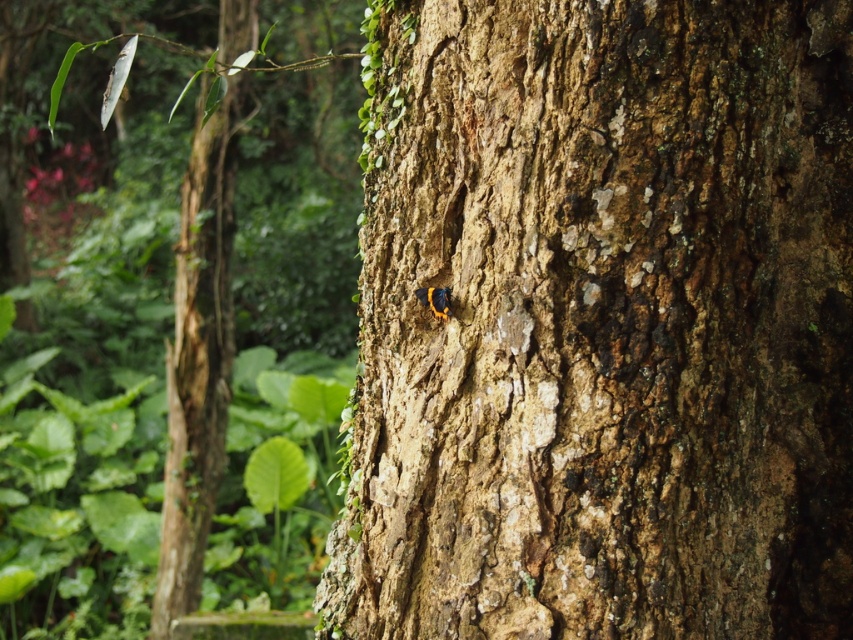
Question: Can you confirm if smooth bark tree trunk at center is wider than shiny orange butterfly at center?

Choices:
 (A) no
 (B) yes

Answer: (B)

Question: Estimate the real-world distances between objects in this image. Which object is farther from the brown rough tree trunk at left?

Choices:
 (A) smooth bark tree trunk at center
 (B) shiny orange butterfly at center

Answer: (B)

Question: Considering the real-world distances, which object is closest to the shiny orange butterfly at center?

Choices:
 (A) smooth bark tree trunk at center
 (B) rough bark tree at center

Answer: (A)

Question: Which object is the closest to the smooth bark tree trunk at center?

Choices:
 (A) brown rough tree trunk at left
 (B) shiny orange butterfly at center
 (C) rough bark tree at center

Answer: (B)

Question: Can you confirm if smooth bark tree trunk at center is positioned to the left of shiny orange butterfly at center?

Choices:
 (A) yes
 (B) no

Answer: (B)

Question: From the image, what is the correct spatial relationship of brown rough tree trunk at left in relation to shiny orange butterfly at center?

Choices:
 (A) above
 (B) below

Answer: (A)